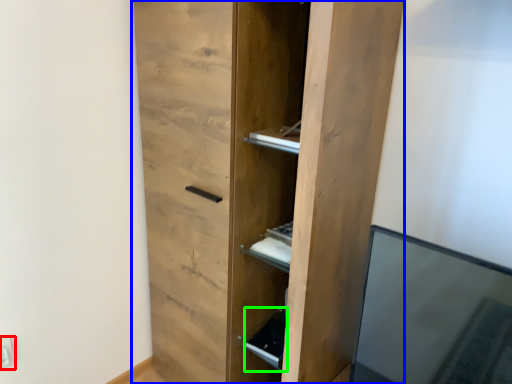
Question: Which object is the closest to the electric outlet (highlighted by a red box)? Choose among these: cupboard (highlighted by a blue box) or cabinet (highlighted by a green box).

Choices:
 (A) cupboard
 (B) cabinet

Answer: (B)